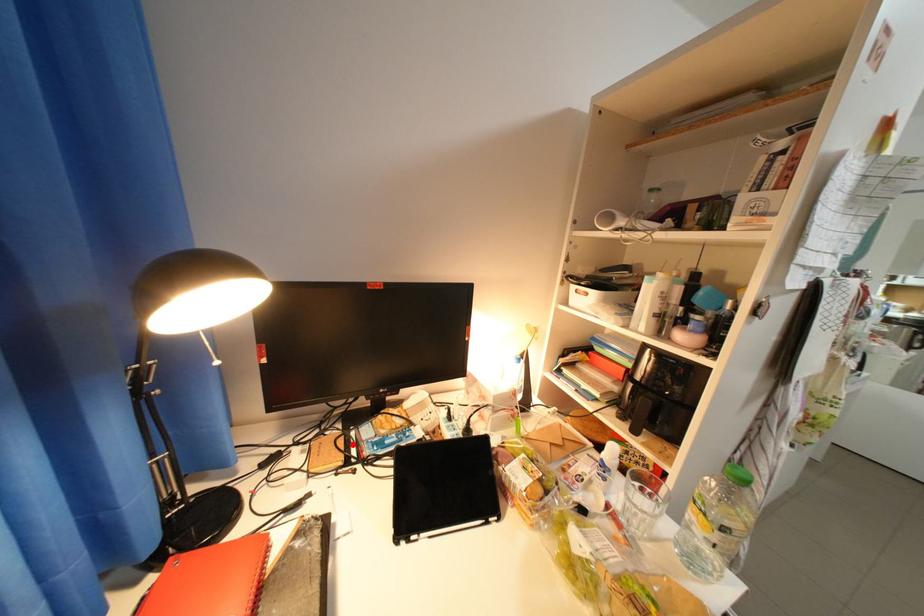
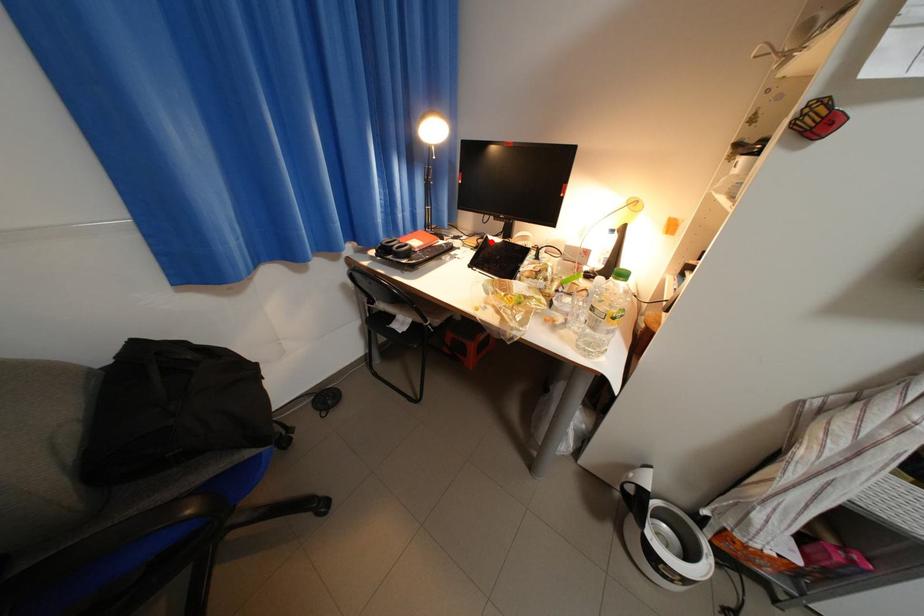
I am providing you with two images of the same scene from different viewpoints. A red point is marked on the first image and another point is marked on the second image. Do the highlighted points in image1 and image2 indicate the same real-world spot?

Yes